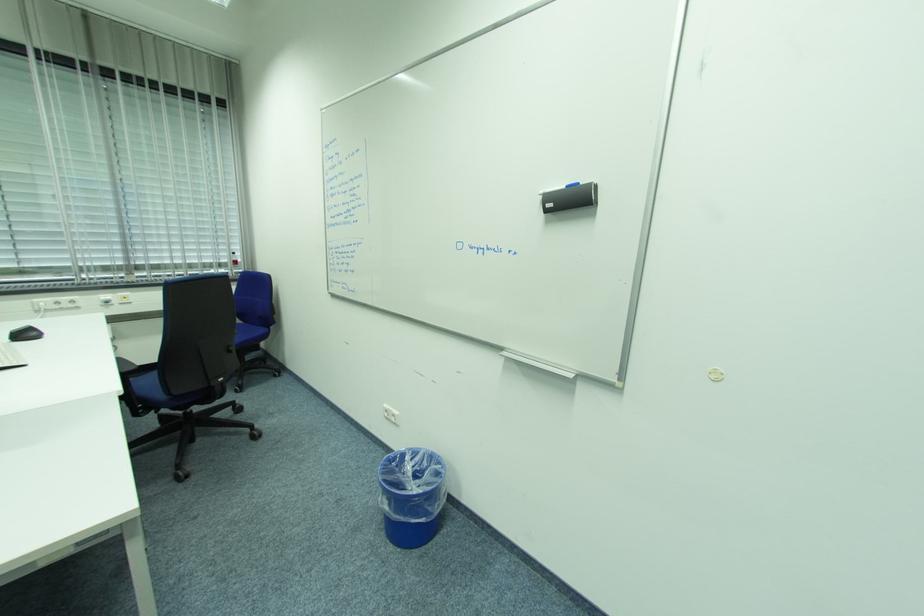
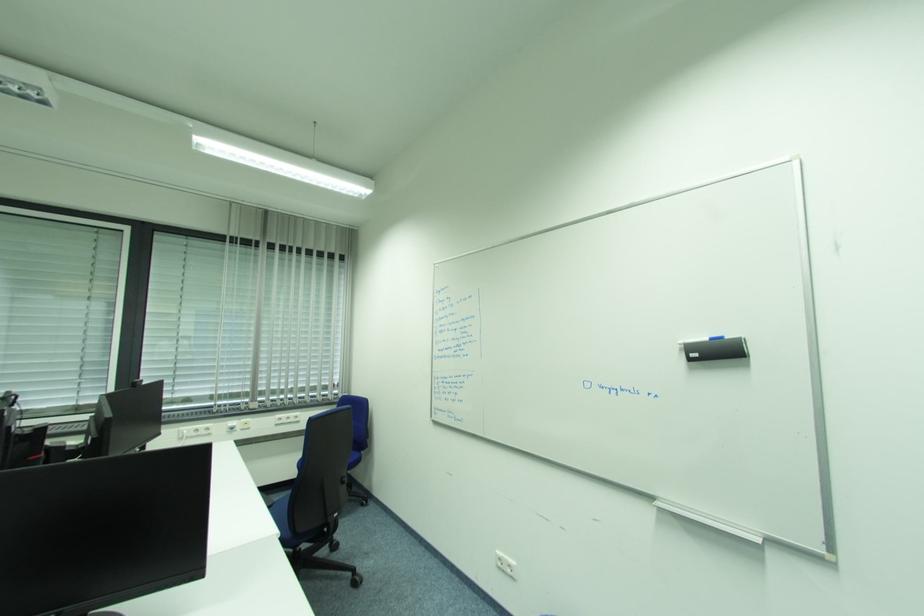
In a continuous first-person perspective shot, in which direction is the camera moving?

The cameraman moved toward left, backward.